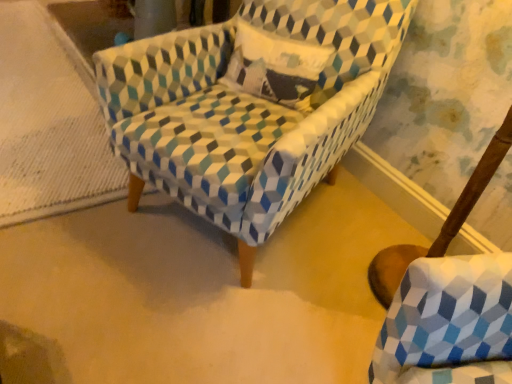
Question: Looking at their shapes, would you say textured fabric armchair at center is wider or thinner than textured fabric swivel chair at lower right?

Choices:
 (A) thin
 (B) wide

Answer: (B)

Question: In the image, is textured fabric armchair at center on the left side or the right side of textured fabric swivel chair at lower right?

Choices:
 (A) right
 (B) left

Answer: (B)

Question: Estimate the real-world distances between objects in this image. Which object is closer to the textured fabric armchair at center?

Choices:
 (A) textured cotton pillow at center
 (B) textured fabric swivel chair at lower right

Answer: (A)

Question: Which is nearer to the textured fabric swivel chair at lower right?

Choices:
 (A) textured cotton pillow at center
 (B) textured fabric armchair at center

Answer: (B)